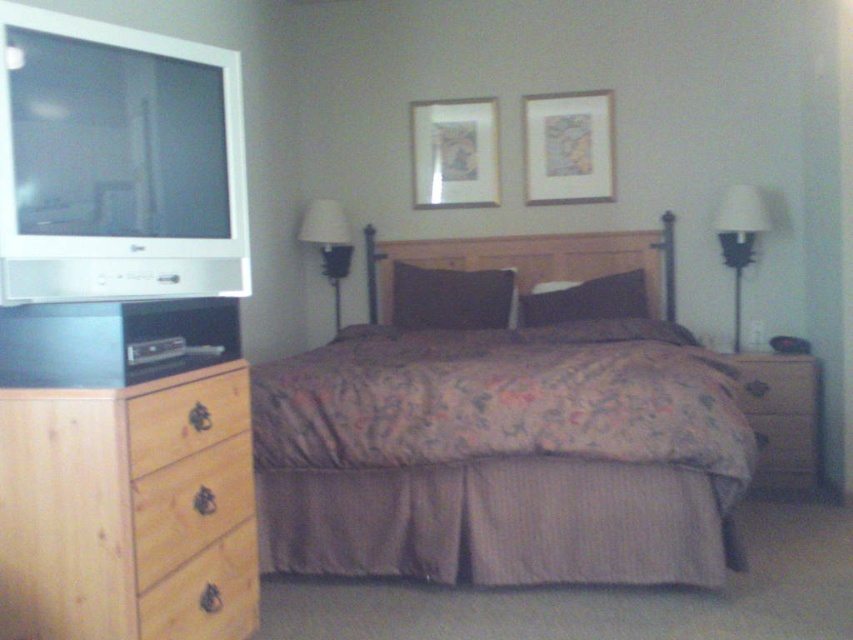
Question: Based on their relative distances, which object is nearer to the black matte pillow at center?

Choices:
 (A) brown wood drawer at lower left
 (B) light brown wood drawer at lower left
 (C) light wood dresser at left
 (D) wooden headboard at center

Answer: (D)

Question: Which object is farther from the camera taking this photo?

Choices:
 (A) silver metallic television at left
 (B) brown wood dresser at lower right
 (C) matte wooden picture frame at upper center
 (D) matte silver picture frame at upper center

Answer: (D)

Question: Which point is closer to the camera?

Choices:
 (A) (38, 8)
 (B) (177, 396)
 (C) (335, 204)
 (D) (763, 358)

Answer: (A)

Question: Can you confirm if silver metallic television at left is positioned above wooden headboard at center?

Choices:
 (A) no
 (B) yes

Answer: (B)

Question: Where is wooden drawer at lower left located in relation to black matte pillow at center in the image?

Choices:
 (A) left
 (B) right

Answer: (A)

Question: Is wooden drawer at lower left thinner than matte black pillow at center?

Choices:
 (A) no
 (B) yes

Answer: (B)